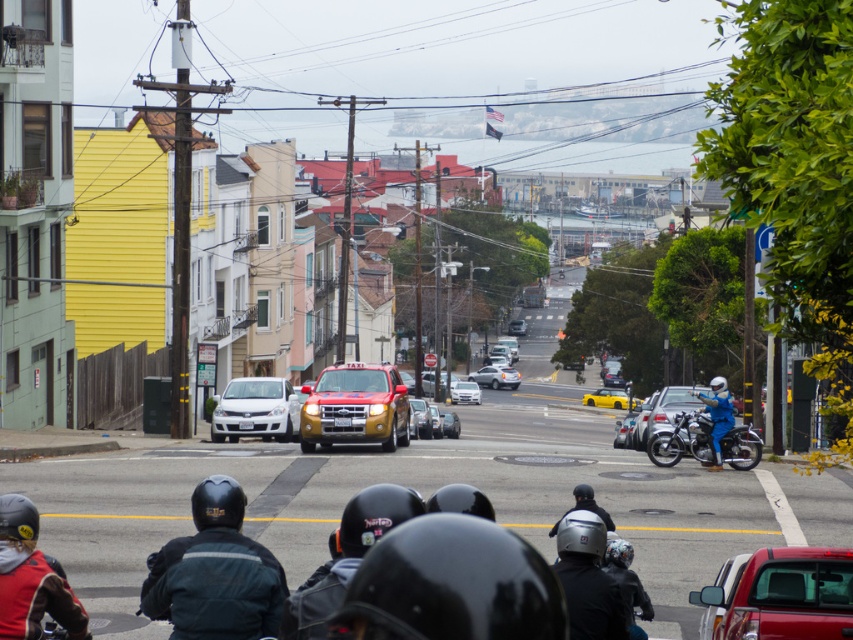
Question: Estimate the real-world distances between objects in this image. Which object is farther from the metallic silver motorcycle at right?

Choices:
 (A) satin white sedan at center
 (B) matte red truck at lower right
 (C) gold metallic taxi at center
 (D) red leather jacket at lower left

Answer: (D)

Question: Considering the relative positions of satin silver sedan at center and white glossy sedan at center in the image provided, where is satin silver sedan at center located with respect to white glossy sedan at center?

Choices:
 (A) left
 (B) right

Answer: (B)

Question: Which of the following is the farthest from the observer?

Choices:
 (A) (402, 392)
 (B) (636, 403)
 (C) (567, 582)
 (D) (469, 401)

Answer: (D)

Question: Is dark gray matte jacket at lower left to the right of gold metallic taxi at center from the viewer's perspective?

Choices:
 (A) yes
 (B) no

Answer: (B)

Question: Is metallic gold taxi at center smaller than shiny black helmet at center?

Choices:
 (A) no
 (B) yes

Answer: (B)

Question: Which point is closer to the camera taking this photo?

Choices:
 (A) (691, 436)
 (B) (273, 632)
 (C) (517, 387)
 (D) (259, 413)

Answer: (B)